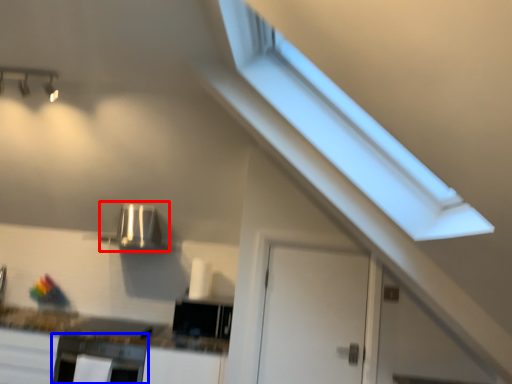
Question: Which point is further to the camera, appliance (highlighted by a red box) or oven (highlighted by a blue box)?

Choices:
 (A) appliance
 (B) oven

Answer: (A)